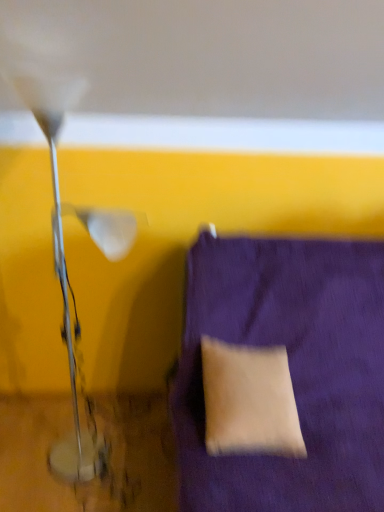
Question: Does purple fabric cushion at lower right have a smaller size compared to metallic silver lamp at left?

Choices:
 (A) yes
 (B) no

Answer: (B)

Question: Is purple fabric cushion at lower right positioned beyond the bounds of metallic silver lamp at left?

Choices:
 (A) yes
 (B) no

Answer: (A)

Question: Can you confirm if purple fabric cushion at lower right is positioned to the right of metallic silver lamp at left?

Choices:
 (A) no
 (B) yes

Answer: (B)

Question: Is there a large distance between purple fabric cushion at lower right and metallic silver lamp at left?

Choices:
 (A) no
 (B) yes

Answer: (A)

Question: From the image's perspective, is purple fabric cushion at lower right under metallic silver lamp at left?

Choices:
 (A) no
 (B) yes

Answer: (B)

Question: Looking at their shapes, would you say beige fabric pillow at lower right is wider or thinner than purple fabric cushion at lower right?

Choices:
 (A) thin
 (B) wide

Answer: (A)

Question: Looking at the image, does beige fabric pillow at lower right seem bigger or smaller compared to purple fabric cushion at lower right?

Choices:
 (A) big
 (B) small

Answer: (B)

Question: Is point (243, 387) closer or farther from the camera than point (210, 462)?

Choices:
 (A) farther
 (B) closer

Answer: (A)

Question: Is beige fabric pillow at lower right to the left or to the right of purple fabric cushion at lower right in the image?

Choices:
 (A) left
 (B) right

Answer: (A)

Question: In the image, is beige fabric pillow at lower right positioned in front of or behind metallic silver lamp at left?

Choices:
 (A) front
 (B) behind

Answer: (B)

Question: From a real-world perspective, relative to metallic silver lamp at left, is beige fabric pillow at lower right vertically above or below?

Choices:
 (A) below
 (B) above

Answer: (A)

Question: Is point (251, 394) closer or farther from the camera than point (56, 102)?

Choices:
 (A) farther
 (B) closer

Answer: (A)

Question: From the image's perspective, is beige fabric pillow at lower right located above or below metallic silver lamp at left?

Choices:
 (A) below
 (B) above

Answer: (A)

Question: From a real-world perspective, is purple fabric cushion at lower right positioned above or below metallic silver lamp at left?

Choices:
 (A) above
 (B) below

Answer: (B)

Question: Relative to metallic silver lamp at left, is purple fabric cushion at lower right in front or behind?

Choices:
 (A) behind
 (B) front

Answer: (B)